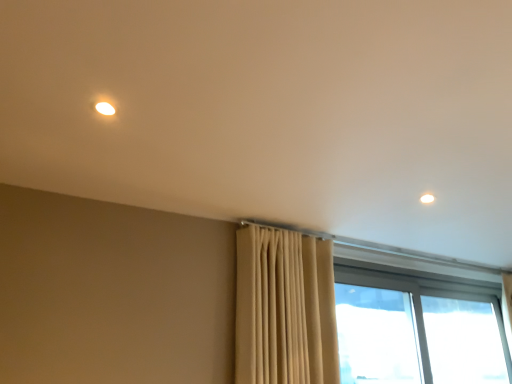
Question: Considering the positions of point (330, 322) and point (495, 334), is point (330, 322) closer or farther from the camera than point (495, 334)?

Choices:
 (A) farther
 (B) closer

Answer: (B)

Question: Is beige fabric curtain at center to the left or to the right of transparent glass window at right, the 2th window when ordered from left to right, in the image?

Choices:
 (A) left
 (B) right

Answer: (A)

Question: Considering the real-world distances, which object is closest to the transparent glass window at right, the 2th window when ordered from left to right?

Choices:
 (A) beige fabric curtain at center
 (B) transparent glass window at lower right, which is counted as the second window, starting from the right

Answer: (B)

Question: Considering the real-world distances, which object is closest to the transparent glass window at right, the first window when ordered from right to left?

Choices:
 (A) transparent glass window at lower right, which is counted as the second window, starting from the right
 (B) beige fabric curtain at center

Answer: (A)